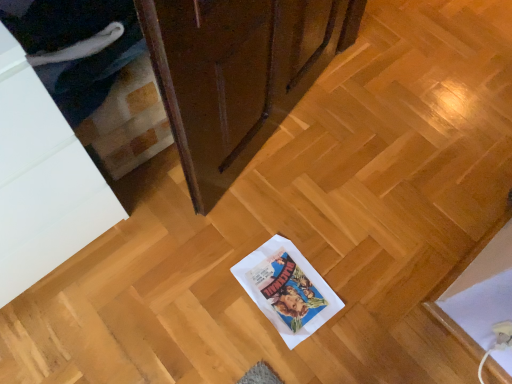
Measure the distance between point (x=0, y=74) and camera.

A distance of 26.69 inches exists between point (x=0, y=74) and camera.

Where is `white glossy cabinet at left, the 1th cabinetry viewed from the left`? This screenshot has width=512, height=384. white glossy cabinet at left, the 1th cabinetry viewed from the left is located at coordinates (42, 180).

This screenshot has width=512, height=384. What do you see at coordinates (42, 180) in the screenshot?
I see `white glossy cabinet at left, which ranks as the second cabinetry in right-to-left order` at bounding box center [42, 180].

Find the location of `matte brown cabinet at upper center, positioned as the 1th cabinetry in right-to-left order`. matte brown cabinet at upper center, positioned as the 1th cabinetry in right-to-left order is located at coordinates (237, 74).

Describe the element at coordinates (237, 74) in the screenshot. This screenshot has height=384, width=512. I see `matte brown cabinet at upper center, the 2th cabinetry from the left` at that location.

This screenshot has width=512, height=384. What are the coordinates of `white glossy cabinet at left, which ranks as the second cabinetry in right-to-left order` in the screenshot? It's located at (42, 180).

Considering the relative positions of white glossy cabinet at left, which ranks as the second cabinetry in right-to-left order, and matte brown cabinet at upper center, positioned as the 1th cabinetry in right-to-left order, in the image provided, is white glossy cabinet at left, which ranks as the second cabinetry in right-to-left order, to the right of matte brown cabinet at upper center, positioned as the 1th cabinetry in right-to-left order, from the viewer's perspective?

Incorrect, white glossy cabinet at left, which ranks as the second cabinetry in right-to-left order, is not on the right side of matte brown cabinet at upper center, positioned as the 1th cabinetry in right-to-left order.

Which object is further away from the camera, white glossy cabinet at left, which ranks as the second cabinetry in right-to-left order, or matte brown cabinet at upper center, the 2th cabinetry from the left?

matte brown cabinet at upper center, the 2th cabinetry from the left.

Does point (9, 292) appear closer or farther from the camera than point (298, 54)?

Point (9, 292) appears to be closer to the viewer than point (298, 54).

From the image's perspective, which is above, white glossy cabinet at left, which ranks as the second cabinetry in right-to-left order, or matte brown cabinet at upper center, positioned as the 1th cabinetry in right-to-left order?

→ matte brown cabinet at upper center, positioned as the 1th cabinetry in right-to-left order.

From a real-world perspective, which object rests below the other?

matte brown cabinet at upper center, the 2th cabinetry from the left, is physically lower.

In the scene shown: Which object is thinner, white glossy cabinet at left, the 1th cabinetry viewed from the left, or matte brown cabinet at upper center, positioned as the 1th cabinetry in right-to-left order?

Thinner between the two is matte brown cabinet at upper center, positioned as the 1th cabinetry in right-to-left order.

Based on the photo, is white glossy cabinet at left, which ranks as the second cabinetry in right-to-left order, taller than matte brown cabinet at upper center, the 2th cabinetry from the left?

Indeed, white glossy cabinet at left, which ranks as the second cabinetry in right-to-left order, has a greater height compared to matte brown cabinet at upper center, the 2th cabinetry from the left.

Which of these two, white glossy cabinet at left, which ranks as the second cabinetry in right-to-left order, or matte brown cabinet at upper center, positioned as the 1th cabinetry in right-to-left order, is bigger?

white glossy cabinet at left, which ranks as the second cabinetry in right-to-left order, is bigger.

Do you think white glossy cabinet at left, which ranks as the second cabinetry in right-to-left order, is within matte brown cabinet at upper center, the 2th cabinetry from the left, or outside of it?

white glossy cabinet at left, which ranks as the second cabinetry in right-to-left order, cannot be found inside matte brown cabinet at upper center, the 2th cabinetry from the left.

Are white glossy cabinet at left, which ranks as the second cabinetry in right-to-left order, and matte brown cabinet at upper center, the 2th cabinetry from the left, making contact?

No, white glossy cabinet at left, which ranks as the second cabinetry in right-to-left order, is not making contact with matte brown cabinet at upper center, the 2th cabinetry from the left.

Is white glossy cabinet at left, which ranks as the second cabinetry in right-to-left order, turned away from matte brown cabinet at upper center, the 2th cabinetry from the left?

No, white glossy cabinet at left, which ranks as the second cabinetry in right-to-left order,'s orientation is not away from matte brown cabinet at upper center, the 2th cabinetry from the left.

How much distance is there between white glossy cabinet at left, which ranks as the second cabinetry in right-to-left order, and matte brown cabinet at upper center, the 2th cabinetry from the left?

They are 40.77 centimeters apart.

Image resolution: width=512 pixels, height=384 pixels. I want to click on cabinetry that appears above the white glossy cabinet at left, which ranks as the second cabinetry in right-to-left order (from the image's perspective), so click(x=237, y=74).

Can you confirm if matte brown cabinet at upper center, positioned as the 1th cabinetry in right-to-left order, is positioned to the right of white glossy cabinet at left, the 1th cabinetry viewed from the left?

Yes.

Is matte brown cabinet at upper center, positioned as the 1th cabinetry in right-to-left order, positioned in front of white glossy cabinet at left, the 1th cabinetry viewed from the left?

No.

Does point (172, 1) come behind point (26, 61)?

No, (172, 1) is in front of (26, 61).

From the image's perspective, which object appears higher, matte brown cabinet at upper center, the 2th cabinetry from the left, or white glossy cabinet at left, which ranks as the second cabinetry in right-to-left order?

matte brown cabinet at upper center, the 2th cabinetry from the left, from the image's perspective.

From a real-world perspective, is matte brown cabinet at upper center, positioned as the 1th cabinetry in right-to-left order, on white glossy cabinet at left, which ranks as the second cabinetry in right-to-left order?

No, from a real-world perspective, matte brown cabinet at upper center, positioned as the 1th cabinetry in right-to-left order, is not over white glossy cabinet at left, which ranks as the second cabinetry in right-to-left order

In terms of width, does matte brown cabinet at upper center, the 2th cabinetry from the left, look wider or thinner when compared to white glossy cabinet at left, which ranks as the second cabinetry in right-to-left order?

In the image, matte brown cabinet at upper center, the 2th cabinetry from the left, appears to be more narrow than white glossy cabinet at left, which ranks as the second cabinetry in right-to-left order.

Which of these two, matte brown cabinet at upper center, positioned as the 1th cabinetry in right-to-left order, or white glossy cabinet at left, the 1th cabinetry viewed from the left, stands shorter?

Standing shorter between the two is matte brown cabinet at upper center, positioned as the 1th cabinetry in right-to-left order.

Considering the relative sizes of matte brown cabinet at upper center, positioned as the 1th cabinetry in right-to-left order, and white glossy cabinet at left, which ranks as the second cabinetry in right-to-left order, in the image provided, is matte brown cabinet at upper center, positioned as the 1th cabinetry in right-to-left order, bigger than white glossy cabinet at left, which ranks as the second cabinetry in right-to-left order,?

Actually, matte brown cabinet at upper center, positioned as the 1th cabinetry in right-to-left order, might be smaller than white glossy cabinet at left, which ranks as the second cabinetry in right-to-left order.

Looking at this image, does matte brown cabinet at upper center, positioned as the 1th cabinetry in right-to-left order, contain white glossy cabinet at left, the 1th cabinetry viewed from the left?

No.

Does matte brown cabinet at upper center, positioned as the 1th cabinetry in right-to-left order, touch white glossy cabinet at left, the 1th cabinetry viewed from the left?

No, matte brown cabinet at upper center, positioned as the 1th cabinetry in right-to-left order, is not in contact with white glossy cabinet at left, the 1th cabinetry viewed from the left.

Is white glossy cabinet at left, which ranks as the second cabinetry in right-to-left order, at the back of matte brown cabinet at upper center, positioned as the 1th cabinetry in right-to-left order?

No, matte brown cabinet at upper center, positioned as the 1th cabinetry in right-to-left order,'s orientation is not away from white glossy cabinet at left, which ranks as the second cabinetry in right-to-left order.

How many degrees apart are the facing directions of matte brown cabinet at upper center, positioned as the 1th cabinetry in right-to-left order, and white glossy cabinet at left, which ranks as the second cabinetry in right-to-left order?

There is a 1.7-degree angle between the facing directions of matte brown cabinet at upper center, positioned as the 1th cabinetry in right-to-left order, and white glossy cabinet at left, which ranks as the second cabinetry in right-to-left order.

Measure the distance from matte brown cabinet at upper center, the 2th cabinetry from the left, to white glossy cabinet at left, the 1th cabinetry viewed from the left.

A distance of 16.05 inches exists between matte brown cabinet at upper center, the 2th cabinetry from the left, and white glossy cabinet at left, the 1th cabinetry viewed from the left.

I want to click on cabinetry that appears above the white glossy cabinet at left, the 1th cabinetry viewed from the left (from the image's perspective), so click(x=237, y=74).

You are a GUI agent. You are given a task and a screenshot of the screen. Output one action in this format:
    pyautogui.click(x=<x>, y=<y>)
    Task: Click on the cabinetry above the white glossy cabinet at left, which ranks as the second cabinetry in right-to-left order (from the image's perspective)
    The width and height of the screenshot is (512, 384).
    Given the screenshot: What is the action you would take?
    pyautogui.click(x=237, y=74)

At what (x,y) coordinates should I click in order to perform the action: click on cabinetry on the right of white glossy cabinet at left, which ranks as the second cabinetry in right-to-left order. Please return your answer as a coordinate pair (x, y). The image size is (512, 384). Looking at the image, I should click on (237, 74).